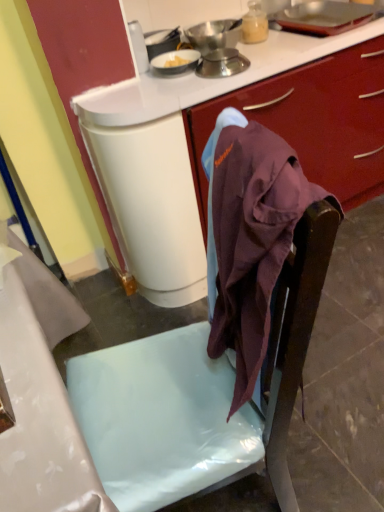
This screenshot has width=384, height=512. In order to click on free space to the left of metallic silver scale at upper center, placed as the 2th kitchen appliance when sorted from top to bottom in this screenshot , I will do `click(179, 82)`.